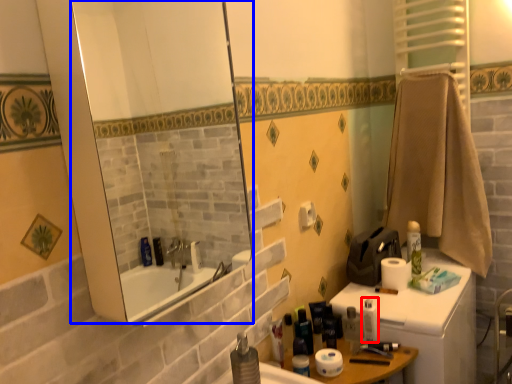
Question: Which of the following is the farthest to the observer, toiletry (highlighted by a red box) or mirror (highlighted by a blue box)?

Choices:
 (A) toiletry
 (B) mirror

Answer: (A)